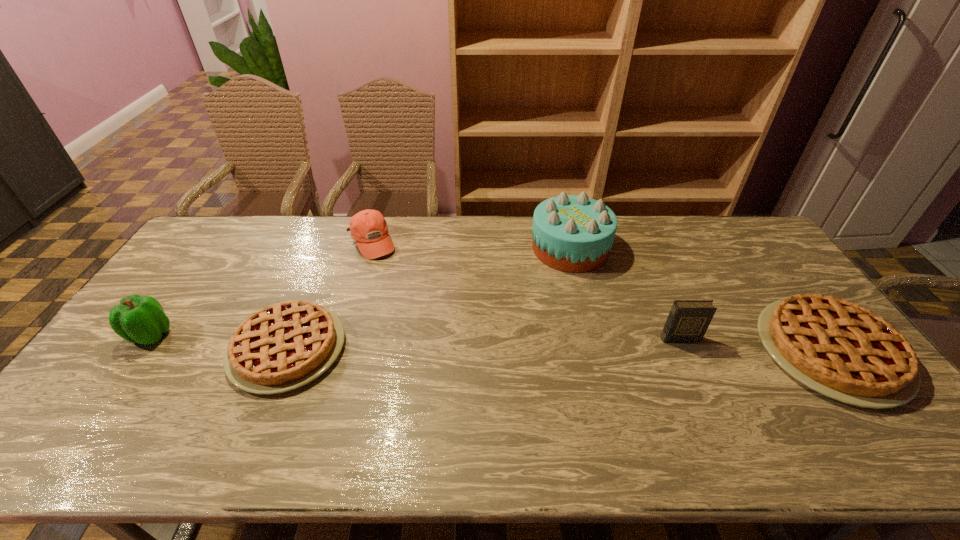
Identify the location of location for an additional pie to make spacing equal. (558, 350).